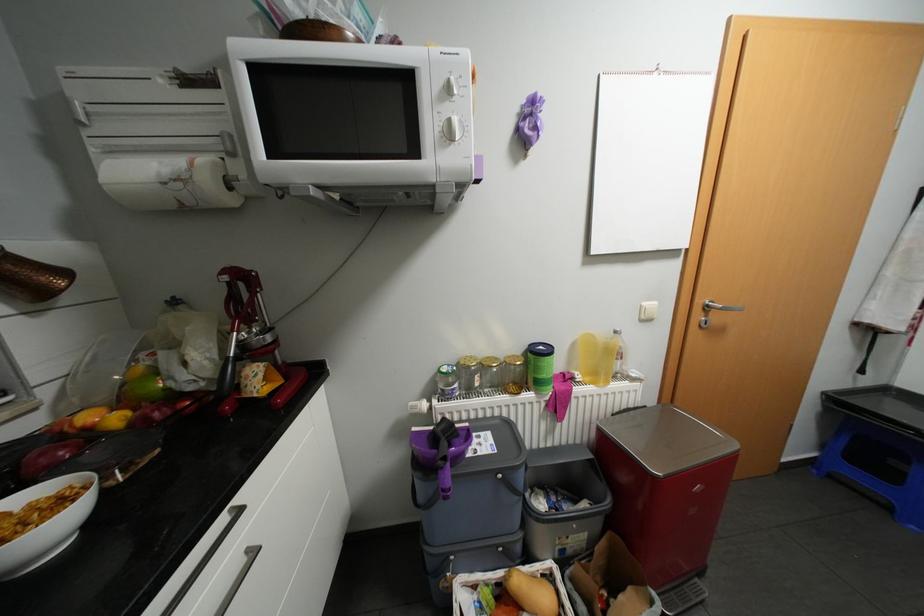
Find where to lift the grey bin lid. Please return your answer as a coordinate pair (x, y).

(666, 439)